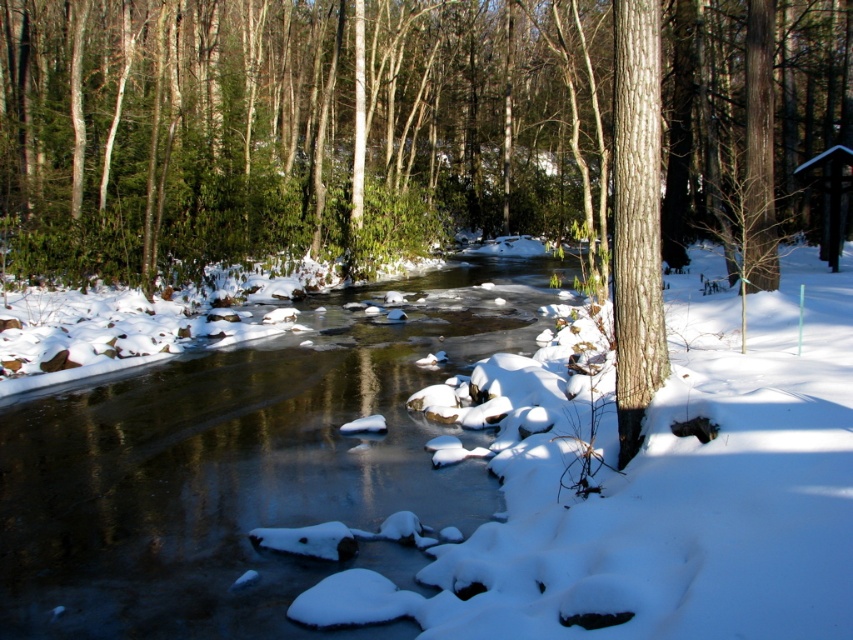
Which is below, clear ice stream at center or smooth brown bark at right?

clear ice stream at center is lower down.

Does clear ice stream at center have a lesser width compared to smooth brown bark at right?

In fact, clear ice stream at center might be wider than smooth brown bark at right.

Image resolution: width=853 pixels, height=640 pixels. In order to click on clear ice stream at center in this screenshot , I will do `click(244, 468)`.